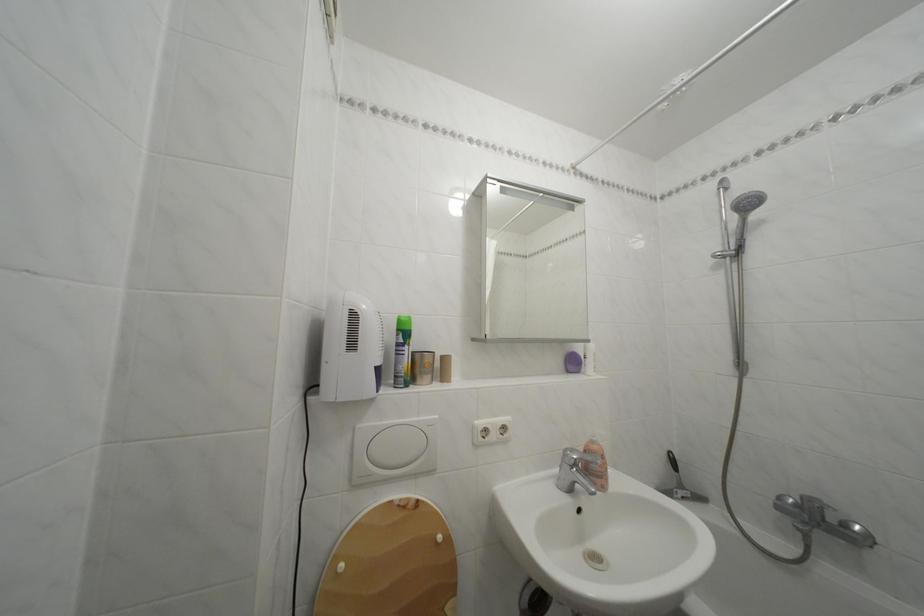
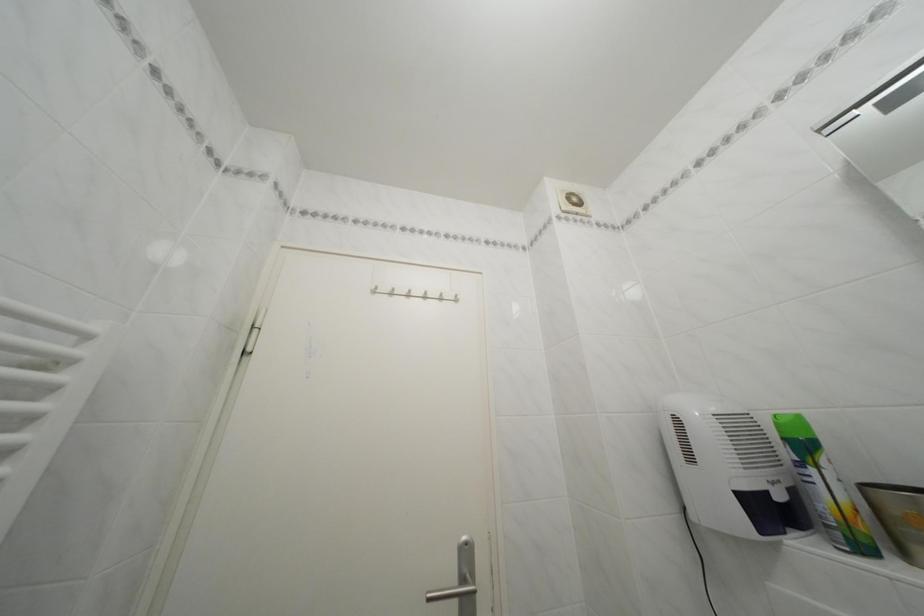
Where in the second image is the point corresponding to (x=360, y=352) from the first image?

(699, 464)